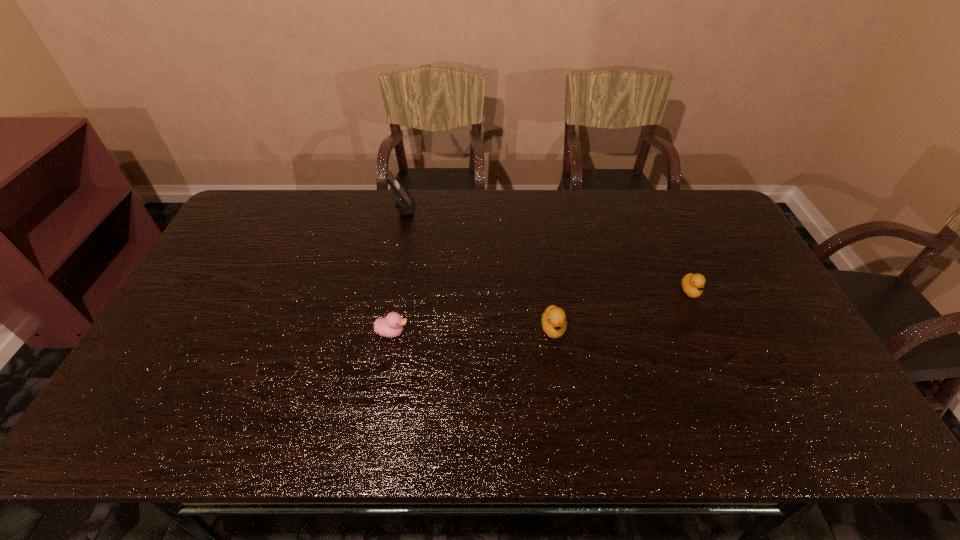
The image size is (960, 540). I want to click on free space that is in between the leftmost duckling and the tallest object, so click(398, 271).

Where is `free space between the third object from left to right and the tallest object`? free space between the third object from left to right and the tallest object is located at coordinates (478, 269).

At what (x,y) coordinates should I click in order to perform the action: click on vacant area that lies between the second object from right to left and the rightmost object. Please return your answer as a coordinate pair (x, y). The height and width of the screenshot is (540, 960). Looking at the image, I should click on (622, 310).

Where is `vacant space that is in between the leftmost duckling and the second farthest object`? vacant space that is in between the leftmost duckling and the second farthest object is located at coordinates (541, 312).

Where is `free space between the tallest object and the leftmost duckling`? The width and height of the screenshot is (960, 540). free space between the tallest object and the leftmost duckling is located at coordinates (398, 271).

Find the location of a particular element. The image size is (960, 540). free spot between the cellular telephone and the second duckling from right to left is located at coordinates (478, 269).

Point out which object is positioned as the second nearest to the rightmost object. Please provide its 2D coordinates. Your answer should be formatted as a tuple, i.e. [(x, y)], where the tuple contains the x and y coordinates of a point satisfying the conditions above.

[(390, 326)]

At what (x,y) coordinates should I click in order to perform the action: click on object identified as the third closest to the tallest object. Please return your answer as a coordinate pair (x, y). Image resolution: width=960 pixels, height=540 pixels. Looking at the image, I should click on (692, 284).

Find the location of a particular element. duckling that is the closest to the rightmost duckling is located at coordinates (554, 323).

This screenshot has height=540, width=960. Find the location of `the closest duckling relative to the farthest duckling`. the closest duckling relative to the farthest duckling is located at coordinates (554, 323).